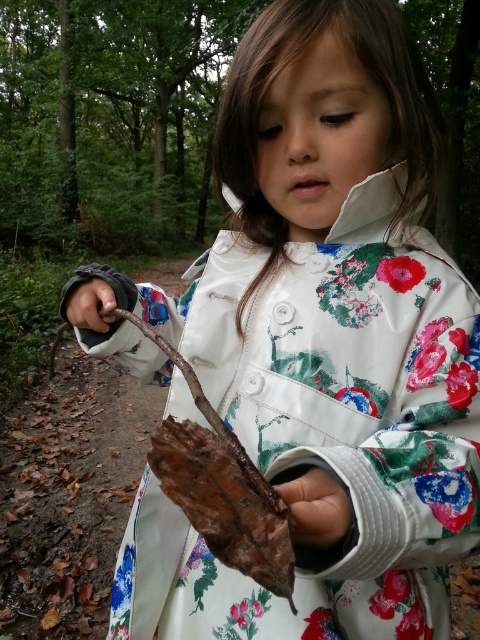
You are a parent trying to ensure your child doesn not drop their items. Looking at the image, which item is positioned lower between the brown rough leaf at lower center and the dark brown leather hand at lower left?

The brown rough leaf at lower center is located below the dark brown leather hand at lower left, so it is positioned lower.

You are navigating through a forest and see two points marked in the image. Which point is closer to you, the point at coordinates point (324, 509) or the point at coordinates point (104, 288)?

Point point (324, 509) is in front of point point (104, 288), so it is closer to you.